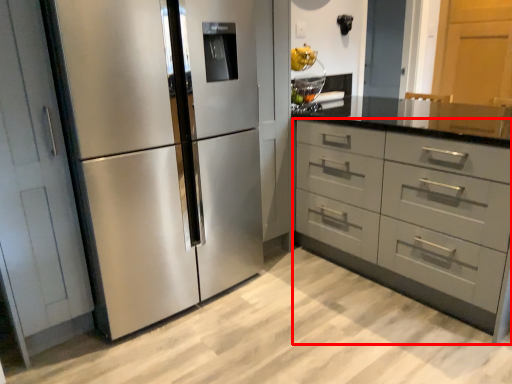
Question: From the image's perspective, considering the relative positions of chest of drawers (annotated by the red box) and refrigerator in the image provided, where is chest of drawers (annotated by the red box) located with respect to the staircase?

Choices:
 (A) above
 (B) below

Answer: (B)